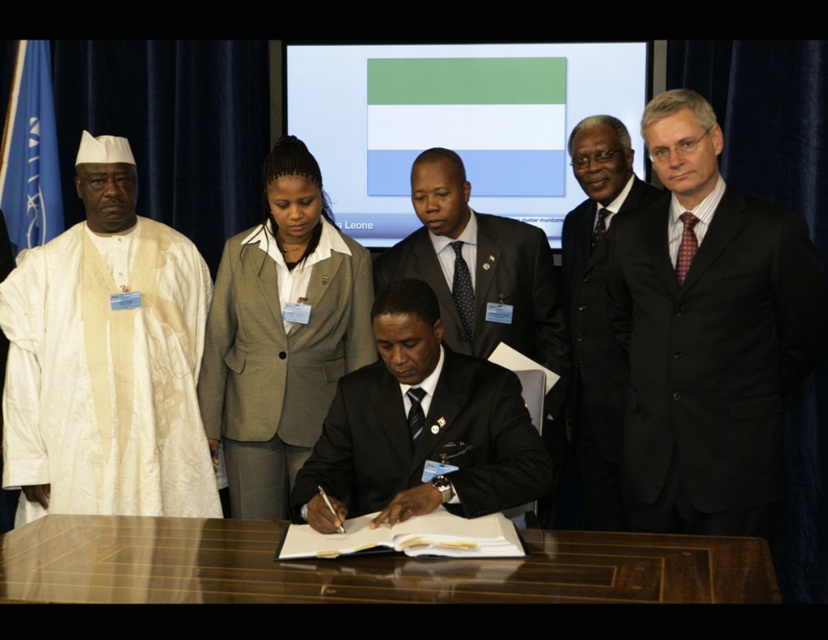
Is wooden at center bigger than gray woolen blazer at center?

No, wooden at center is not bigger than gray woolen blazer at center.

This screenshot has height=640, width=828. Describe the element at coordinates (362, 566) in the screenshot. I see `wooden at center` at that location.

Measure the distance between wooden at center and camera.

They are 1.82 meters apart.

Find the location of a particular element. The image size is (828, 640). wooden at center is located at coordinates (362, 566).

Which of these two, white cloth at left or gray woolen blazer at center, stands taller?

white cloth at left

Is point (186, 458) closer to viewer compared to point (345, 262)?

No, (186, 458) is further to viewer.

Image resolution: width=828 pixels, height=640 pixels. Find the location of `white cloth at left`. white cloth at left is located at coordinates (106, 358).

Is black suit at right shorter than black satin business suit at right?

Yes.

What do you see at coordinates (706, 333) in the screenshot?
I see `black suit at right` at bounding box center [706, 333].

Is point (802, 316) closer to viewer compared to point (564, 285)?

Yes, point (802, 316) is closer to viewer.

Identify the location of black suit at right. The height and width of the screenshot is (640, 828). (706, 333).